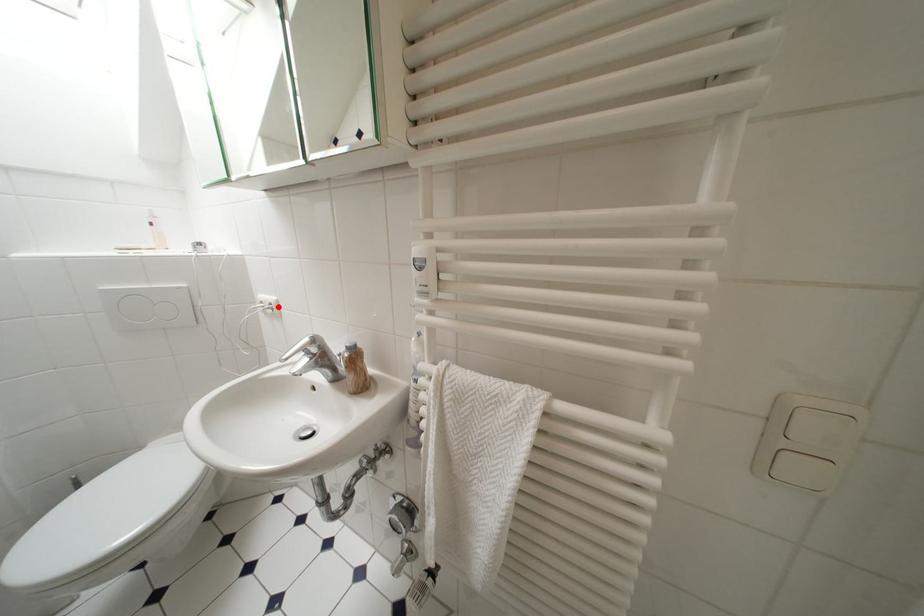
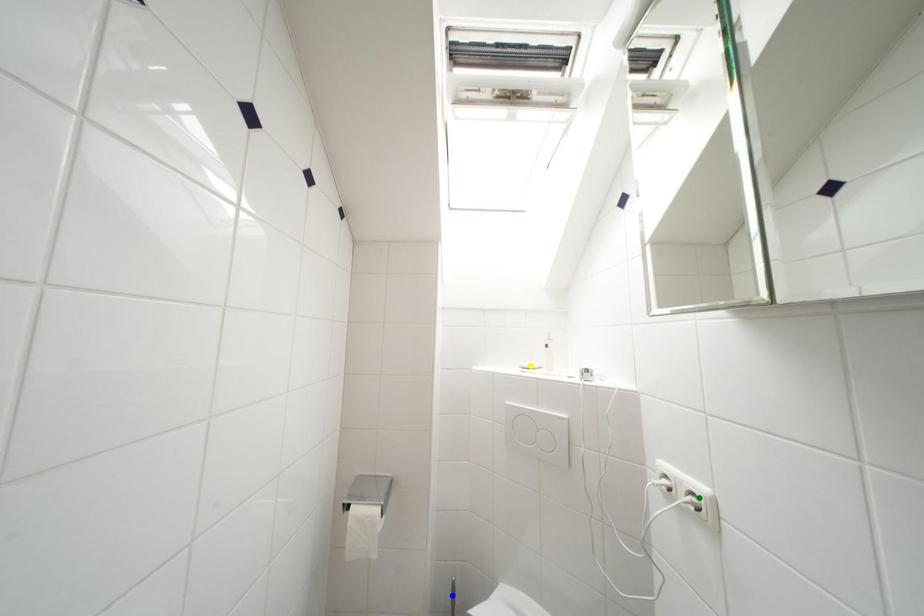
Question: I am providing you with two images of the same scene from different viewpoints. A red point is marked on the first image. You are given multiple points on the second image. Can you choose the point in image 2 that corresponds to the point in image 1?

Choices:
 (A) blue point
 (B) green point
 (C) yellow point

Answer: (B)